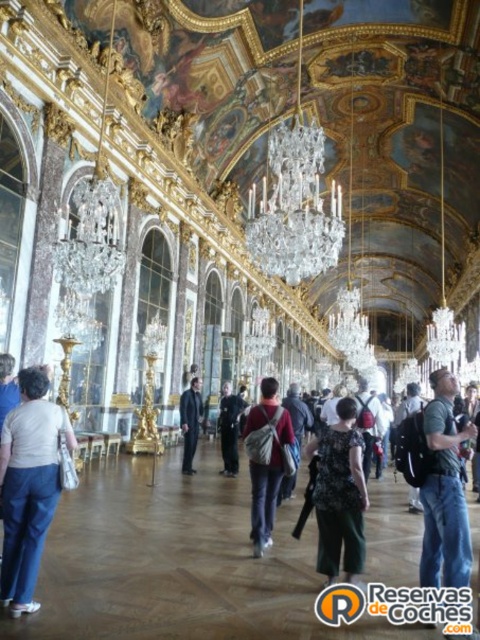
You are a tour guide in the Hall of Mirrors. You notice two visitors wearing a matte white shirt at lower left and a black textured dress at center. Which visitor is closer to the large arched windows on the walls?

The matte white shirt at lower left is closer to the large arched windows on the walls because it is positioned at the lower left, which is near the walls where the windows are located, while the black textured dress at center is further away from the windows as it is in the middle of the hall.